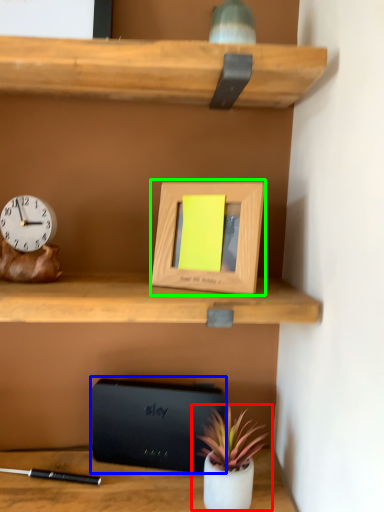
Question: Estimate the real-world distances between objects in this image. Which object is closer to houseplant (highlighted by a red box), paperback book (highlighted by a blue box) or picture frame (highlighted by a green box)?

Choices:
 (A) paperback book
 (B) picture frame

Answer: (A)